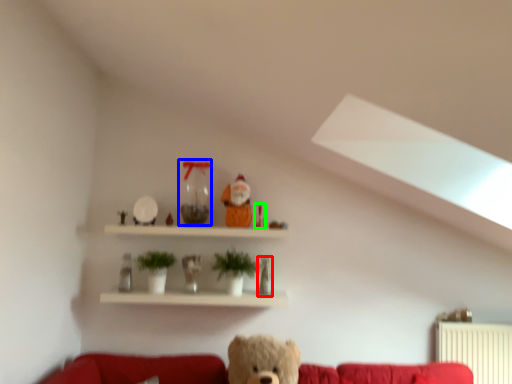
Question: Which object is positioned closest to figurine (highlighted by a red box)? Select from glass vase (highlighted by a blue box) and toy (highlighted by a green box).

Choices:
 (A) glass vase
 (B) toy

Answer: (B)